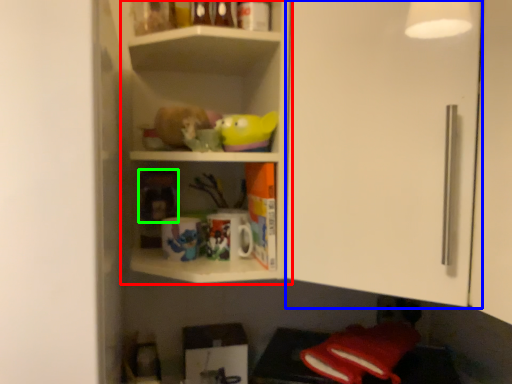
Question: Based on their relative distances, which object is farther from shelf (highlighted by a red box)? Choose from glass door (highlighted by a blue box) and toy (highlighted by a green box).

Choices:
 (A) glass door
 (B) toy

Answer: (B)